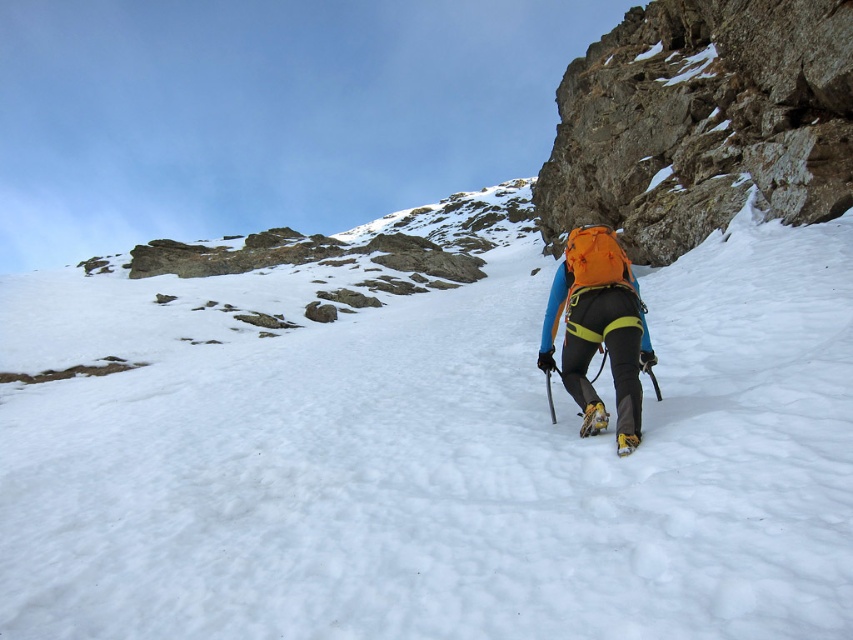
Question: Estimate the real-world distances between objects in this image. Which object is farther from the orange fabric backpack at center?

Choices:
 (A) yellow rubber ski at lower center
 (B) white fluffy snow at center

Answer: (B)

Question: Is white fluffy snow at center closer to the viewer compared to orange fabric backpack at center?

Choices:
 (A) no
 (B) yes

Answer: (B)

Question: Which point is farther to the camera?

Choices:
 (A) yellow rubber ski at lower center
 (B) orange fabric backpack at center
 (C) white fluffy snow at center

Answer: (A)

Question: Does white fluffy snow at center have a lesser width compared to orange fabric backpack at center?

Choices:
 (A) yes
 (B) no

Answer: (B)

Question: Considering the real-world distances, which object is farthest from the yellow rubber ski at lower center?

Choices:
 (A) orange fabric backpack at center
 (B) white fluffy snow at center

Answer: (B)

Question: Can you confirm if white fluffy snow at center is positioned to the left of orange fabric backpack at center?

Choices:
 (A) yes
 (B) no

Answer: (A)